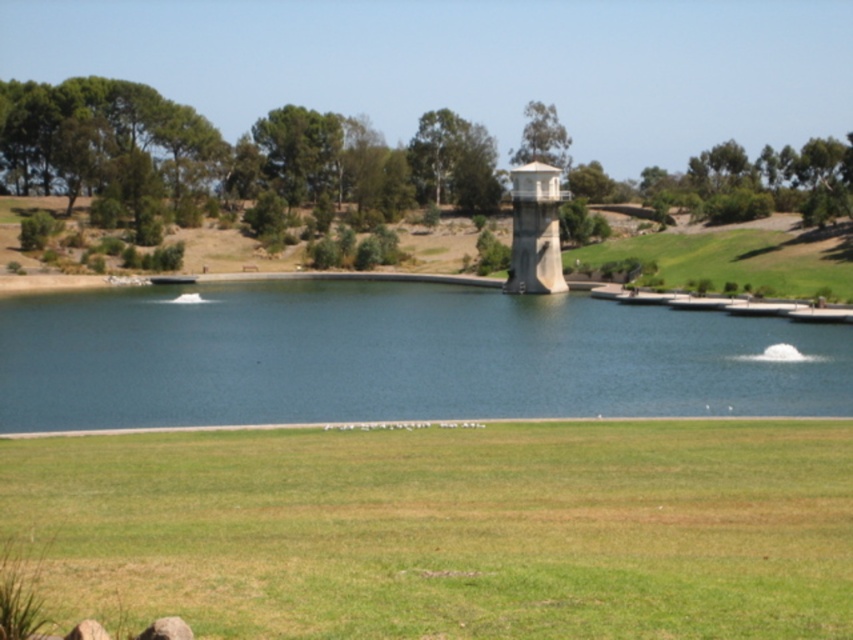
Is green grass at lower center shorter than white concrete water tower at center?

Indeed, green grass at lower center has a lesser height compared to white concrete water tower at center.

Does green grass at lower center have a greater width compared to white concrete water tower at center?

Indeed, green grass at lower center has a greater width compared to white concrete water tower at center.

Where is `green grass at lower center`? green grass at lower center is located at coordinates (448, 531).

Can you confirm if green grass at lower center is positioned to the left of blue smooth water at center?

Incorrect, green grass at lower center is not on the left side of blue smooth water at center.

Can you confirm if green grass at lower center is taller than blue smooth water at center?

In fact, green grass at lower center may be shorter than blue smooth water at center.

Locate an element on the screen. The image size is (853, 640). green grass at lower center is located at coordinates (448, 531).

Is point (697, 353) farther from camera compared to point (541, 204)?

No, (697, 353) is closer to viewer.

Is blue smooth water at center above white concrete water tower at center?

Incorrect, blue smooth water at center is not positioned above white concrete water tower at center.

Between point (47, 390) and point (521, 196), which one is positioned behind?

Positioned behind is point (521, 196).

This screenshot has width=853, height=640. I want to click on blue smooth water at center, so click(396, 356).